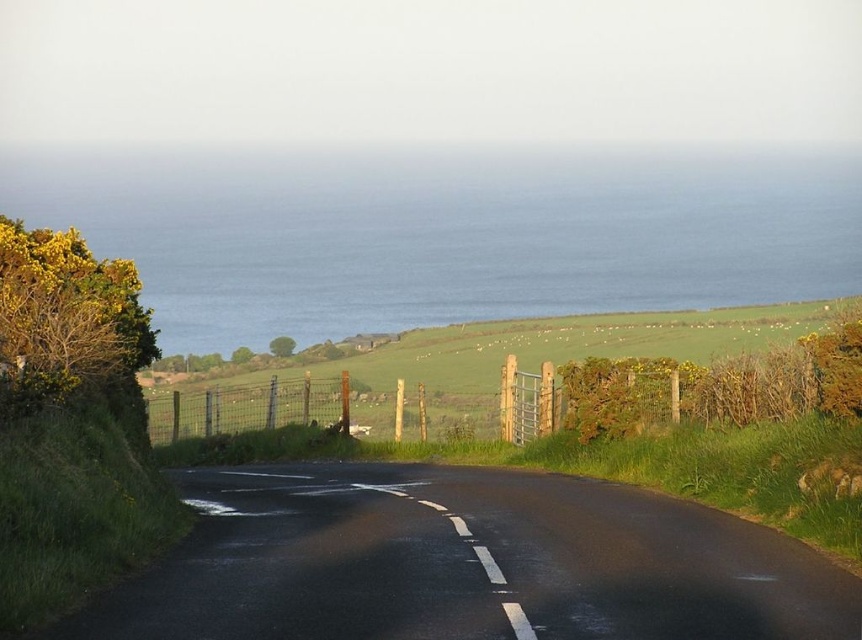
Which is more to the left, blue water at upper center or green grassy hillside at center?

Positioned to the left is blue water at upper center.

In the scene shown: Who is more distant from viewer, (261, 163) or (291, 378)?

The point (261, 163) is behind.

Describe the element at coordinates (448, 236) in the screenshot. The image size is (862, 640). I see `blue water at upper center` at that location.

Identify the location of blue water at upper center. (448, 236).